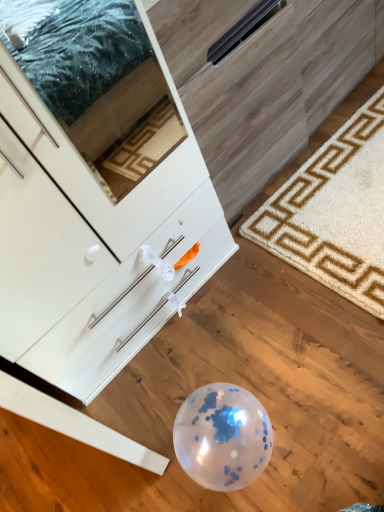
The height and width of the screenshot is (512, 384). I want to click on vacant area on top of white textured rug at lower right (from a real-world perspective), so pos(342,200).